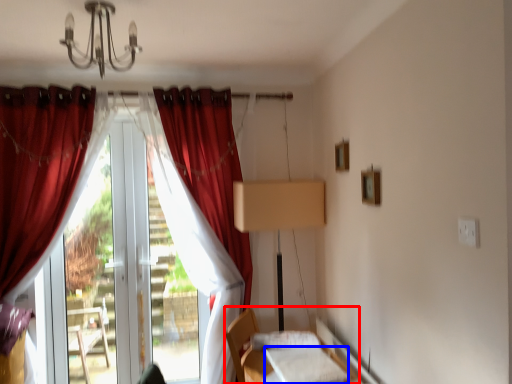
Question: Which point is further to the camera, bed (highlighted by a red box) or sheet (highlighted by a blue box)?

Choices:
 (A) bed
 (B) sheet

Answer: (A)